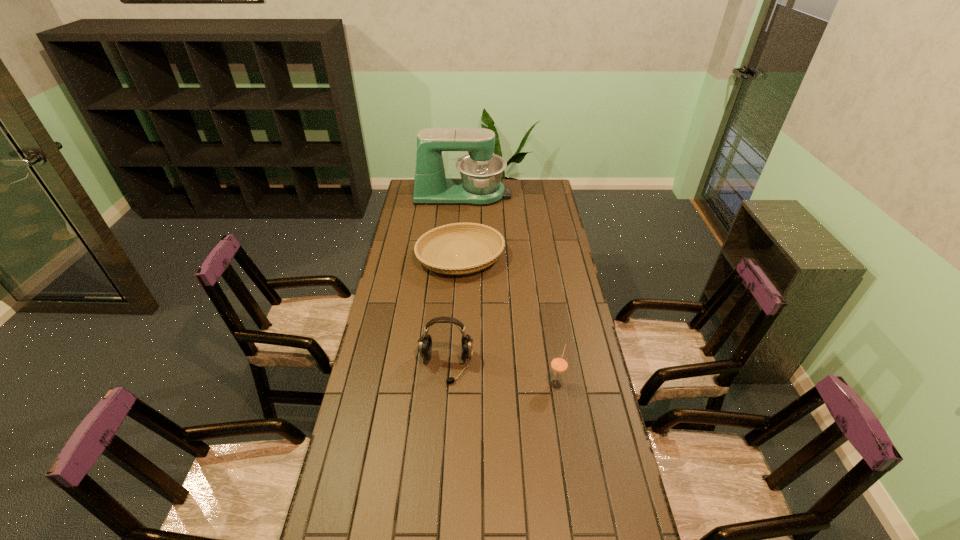
This screenshot has width=960, height=540. Find the location of `blank region between the rightmost object and the basket`. blank region between the rightmost object and the basket is located at coordinates (508, 321).

In order to click on free space between the shortest object and the headset in this screenshot , I will do `click(453, 312)`.

You are a GUI agent. You are given a task and a screenshot of the screen. Output one action in this format:
    pyautogui.click(x=<x>, y=<y>)
    Task: Click on the vacant region between the shortest object and the rightmost object
    This screenshot has width=960, height=540.
    Given the screenshot: What is the action you would take?
    pyautogui.click(x=508, y=321)

Locate an element on the screen. free spot between the third tallest object and the shortest object is located at coordinates (508, 321).

I want to click on vacant area that lies between the farthest object and the headset, so click(x=454, y=280).

Where is `free space between the rightmost object and the shortest object`? free space between the rightmost object and the shortest object is located at coordinates (508, 321).

The width and height of the screenshot is (960, 540). What are the coordinates of `unoccupied position between the third tallest object and the headset` in the screenshot? It's located at (501, 375).

Locate an element on the screen. empty space between the mixer and the third tallest object is located at coordinates (510, 289).

Find the location of `the second closest object to the rightmost object`. the second closest object to the rightmost object is located at coordinates (440, 241).

Locate an element on the screen. Image resolution: width=960 pixels, height=540 pixels. the closest object to the tallest object is located at coordinates (440, 241).